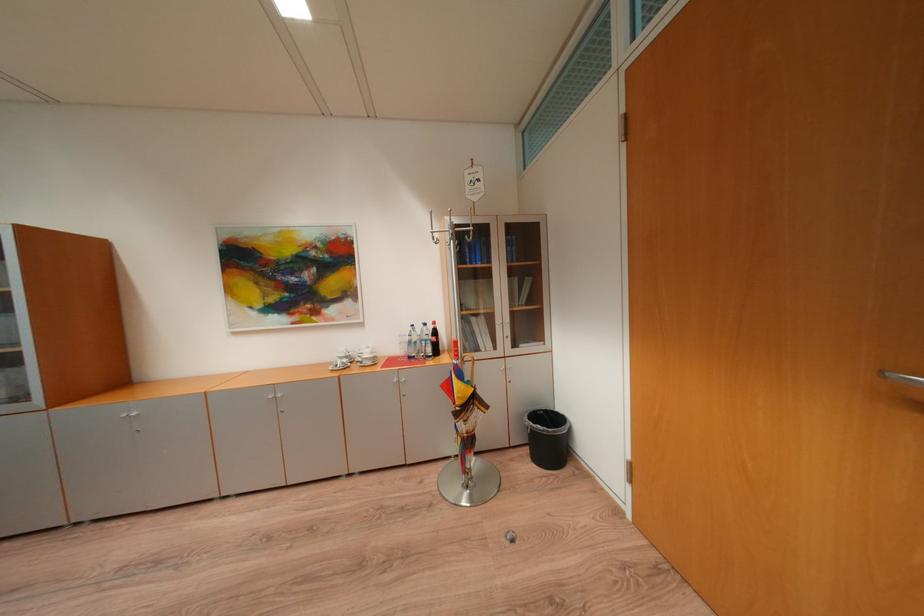
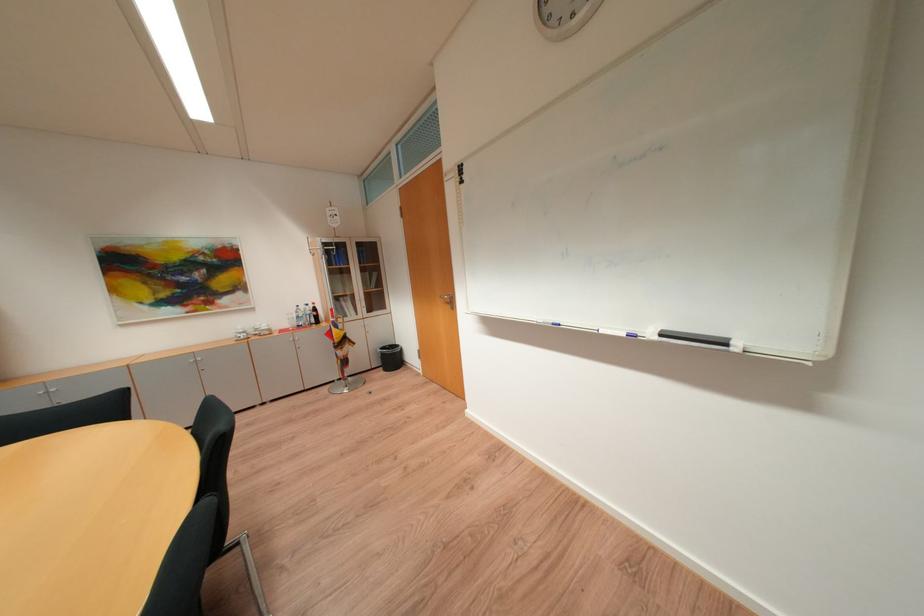
The point at (456, 387) is marked in the first image. Where is the corresponding point in the second image?

(338, 334)